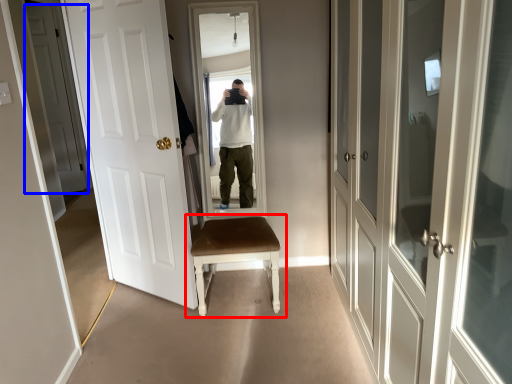
Question: Which object is closer to the camera taking this photo, chair (highlighted by a red box) or door (highlighted by a blue box)?

Choices:
 (A) chair
 (B) door

Answer: (A)